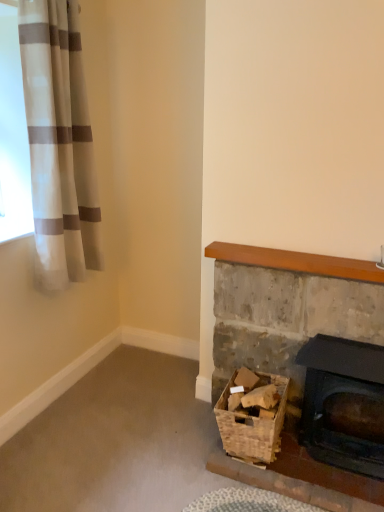
What is the approximate width of white striped fabric at upper left?

19.22 centimeters.

Image resolution: width=384 pixels, height=512 pixels. I want to click on rustic stone fireplace at lower right, marked as the second fireplace in a right-to-left arrangement, so click(292, 348).

Locate an element on the screen. This screenshot has height=512, width=384. matte black fireplace at lower right, the first fireplace in the right-to-left sequence is located at coordinates (343, 404).

Where is `woven brown basket at lower right`? woven brown basket at lower right is located at coordinates (252, 424).

From a real-world perspective, is white striped fabric at upper left physically above matte black fireplace at lower right, the first fireplace in the right-to-left sequence?

Yes, from a real-world perspective, white striped fabric at upper left is over matte black fireplace at lower right, the first fireplace in the right-to-left sequence

Identify the location of the 1st fireplace behind the white striped fabric at upper left, starting your count from the anchor. The image size is (384, 512). click(x=343, y=404).

Is white striped fabric at upper left positioned far away from matte black fireplace at lower right, which ranks as the 2th fireplace in left-to-right order?

Indeed, white striped fabric at upper left is not near matte black fireplace at lower right, which ranks as the 2th fireplace in left-to-right order.

Where is `curtain located above the rustic stone fireplace at lower right, which is the 1th fireplace from left to right (from the image's perspective)`? This screenshot has width=384, height=512. curtain located above the rustic stone fireplace at lower right, which is the 1th fireplace from left to right (from the image's perspective) is located at coordinates (59, 143).

From a real-world perspective, is white striped fabric at upper left beneath rustic stone fireplace at lower right, marked as the second fireplace in a right-to-left arrangement?

Actually, white striped fabric at upper left is physically above rustic stone fireplace at lower right, marked as the second fireplace in a right-to-left arrangement, in the real world.

How different are the orientations of white striped fabric at upper left and rustic stone fireplace at lower right, marked as the second fireplace in a right-to-left arrangement, in degrees?

They differ by 90.1 degrees in their facing directions.

Does white striped fabric at upper left come behind rustic stone fireplace at lower right, marked as the second fireplace in a right-to-left arrangement?

No, it is in front of rustic stone fireplace at lower right, marked as the second fireplace in a right-to-left arrangement.

Who is smaller, matte black fireplace at lower right, the first fireplace in the right-to-left sequence, or rustic stone fireplace at lower right, which is the 1th fireplace from left to right?

matte black fireplace at lower right, the first fireplace in the right-to-left sequence, is smaller.

Considering the sizes of matte black fireplace at lower right, which ranks as the 2th fireplace in left-to-right order, and rustic stone fireplace at lower right, marked as the second fireplace in a right-to-left arrangement, in the image, is matte black fireplace at lower right, which ranks as the 2th fireplace in left-to-right order, wider or thinner than rustic stone fireplace at lower right, marked as the second fireplace in a right-to-left arrangement,?

matte black fireplace at lower right, which ranks as the 2th fireplace in left-to-right order, is wider than rustic stone fireplace at lower right, marked as the second fireplace in a right-to-left arrangement.

Between matte black fireplace at lower right, which ranks as the 2th fireplace in left-to-right order, and rustic stone fireplace at lower right, which is the 1th fireplace from left to right, which one is positioned behind?

Positioned behind is rustic stone fireplace at lower right, which is the 1th fireplace from left to right.

Would you say matte black fireplace at lower right, which ranks as the 2th fireplace in left-to-right order, is to the left or to the right of rustic stone fireplace at lower right, marked as the second fireplace in a right-to-left arrangement, in the picture?

matte black fireplace at lower right, which ranks as the 2th fireplace in left-to-right order, is to the right of rustic stone fireplace at lower right, marked as the second fireplace in a right-to-left arrangement.

Considering the sizes of rustic stone fireplace at lower right, marked as the second fireplace in a right-to-left arrangement, and woven brown basket at lower right in the image, is rustic stone fireplace at lower right, marked as the second fireplace in a right-to-left arrangement, wider or thinner than woven brown basket at lower right?

Considering their sizes, rustic stone fireplace at lower right, marked as the second fireplace in a right-to-left arrangement, looks slimmer than woven brown basket at lower right.

How far apart are rustic stone fireplace at lower right, which is the 1th fireplace from left to right, and woven brown basket at lower right?

rustic stone fireplace at lower right, which is the 1th fireplace from left to right, is 9.98 inches from woven brown basket at lower right.

Between rustic stone fireplace at lower right, which is the 1th fireplace from left to right, and woven brown basket at lower right, which one has larger size?

rustic stone fireplace at lower right, which is the 1th fireplace from left to right, is bigger.

Find the location of a particular element. basket located below the rustic stone fireplace at lower right, which is the 1th fireplace from left to right (from the image's perspective) is located at coordinates (252, 424).

Would you consider woven brown basket at lower right to be distant from rustic stone fireplace at lower right, which is the 1th fireplace from left to right?

No, woven brown basket at lower right is not far away from rustic stone fireplace at lower right, which is the 1th fireplace from left to right.

Is woven brown basket at lower right taller or shorter than rustic stone fireplace at lower right, which is the 1th fireplace from left to right?

Considering their sizes, woven brown basket at lower right has less height than rustic stone fireplace at lower right, which is the 1th fireplace from left to right.

Does point (270, 441) come closer to viewer compared to point (338, 262)?

That is True.

Where is `basket below the matte black fireplace at lower right, which ranks as the 2th fireplace in left-to-right order (from the image's perspective)`? The image size is (384, 512). basket below the matte black fireplace at lower right, which ranks as the 2th fireplace in left-to-right order (from the image's perspective) is located at coordinates (252, 424).

From a real-world perspective, is matte black fireplace at lower right, the first fireplace in the right-to-left sequence, physically below woven brown basket at lower right?

No.

Who is bigger, rustic stone fireplace at lower right, marked as the second fireplace in a right-to-left arrangement, or white striped fabric at upper left?

Bigger between the two is white striped fabric at upper left.

Image resolution: width=384 pixels, height=512 pixels. There is a white striped fabric at upper left. Identify the location of the 1st fireplace below it (from a real-world perspective). (292, 348).

Does rustic stone fireplace at lower right, which is the 1th fireplace from left to right, have a lesser width compared to white striped fabric at upper left?

Correct, the width of rustic stone fireplace at lower right, which is the 1th fireplace from left to right, is less than that of white striped fabric at upper left.

At what (x,y) coordinates should I click in order to perform the action: click on fireplace that is the 2nd one below the white striped fabric at upper left (from a real-world perspective). Please return your answer as a coordinate pair (x, y). The height and width of the screenshot is (512, 384). Looking at the image, I should click on (343, 404).

At what (x,y) coordinates should I click in order to perform the action: click on the 1st fireplace positioned below the white striped fabric at upper left (from the image's perspective). Please return your answer as a coordinate pair (x, y). This screenshot has height=512, width=384. Looking at the image, I should click on (292, 348).

Based on their spatial positions, is matte black fireplace at lower right, the first fireplace in the right-to-left sequence, or woven brown basket at lower right further from rustic stone fireplace at lower right, marked as the second fireplace in a right-to-left arrangement?

woven brown basket at lower right is positioned further to the anchor rustic stone fireplace at lower right, marked as the second fireplace in a right-to-left arrangement.

When comparing their distances from matte black fireplace at lower right, the first fireplace in the right-to-left sequence, does woven brown basket at lower right or white striped fabric at upper left seem further?

white striped fabric at upper left.

Based on their spatial positions, is rustic stone fireplace at lower right, marked as the second fireplace in a right-to-left arrangement, or matte black fireplace at lower right, the first fireplace in the right-to-left sequence, further from woven brown basket at lower right?

matte black fireplace at lower right, the first fireplace in the right-to-left sequence.

Based on their spatial positions, is matte black fireplace at lower right, which ranks as the 2th fireplace in left-to-right order, or rustic stone fireplace at lower right, marked as the second fireplace in a right-to-left arrangement, closer to woven brown basket at lower right?

rustic stone fireplace at lower right, marked as the second fireplace in a right-to-left arrangement, lies closer to woven brown basket at lower right than the other object.

Which object lies further to the anchor point white striped fabric at upper left, matte black fireplace at lower right, the first fireplace in the right-to-left sequence, or woven brown basket at lower right?

Among the two, matte black fireplace at lower right, the first fireplace in the right-to-left sequence, is located further to white striped fabric at upper left.

When comparing their distances from white striped fabric at upper left, does woven brown basket at lower right or matte black fireplace at lower right, which ranks as the 2th fireplace in left-to-right order, seem closer?

woven brown basket at lower right is closer to white striped fabric at upper left.

When comparing their distances from matte black fireplace at lower right, the first fireplace in the right-to-left sequence, does white striped fabric at upper left or rustic stone fireplace at lower right, marked as the second fireplace in a right-to-left arrangement, seem further?

The object further to matte black fireplace at lower right, the first fireplace in the right-to-left sequence, is white striped fabric at upper left.

Estimate the real-world distances between objects in this image. Which object is further from rustic stone fireplace at lower right, which is the 1th fireplace from left to right, woven brown basket at lower right or white striped fabric at upper left?

Among the two, white striped fabric at upper left is located further to rustic stone fireplace at lower right, which is the 1th fireplace from left to right.

Identify the location of fireplace between white striped fabric at upper left and matte black fireplace at lower right, the first fireplace in the right-to-left sequence, from left to right. The height and width of the screenshot is (512, 384). (292, 348).

Locate an element on the screen. fireplace situated between woven brown basket at lower right and matte black fireplace at lower right, which ranks as the 2th fireplace in left-to-right order, from left to right is located at coordinates (292, 348).